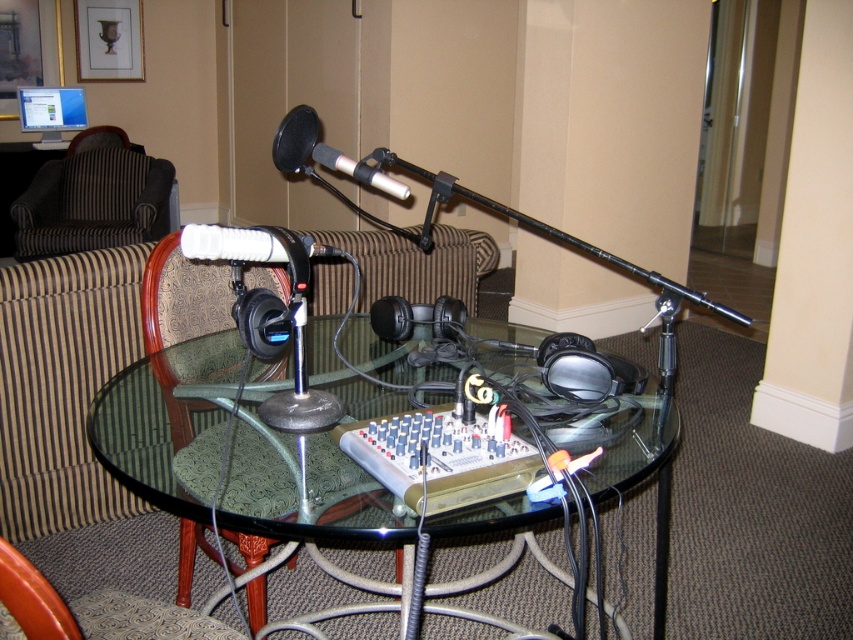
In the scene shown: You are setting up a recording session and need to place a new set of headphones on the transparent glass table at center. Given the size of the table and the headphones, will there be enough space for the new headphones without overlapping the existing black matte headphones at center?

The transparent glass table at center has a larger width than the black matte headphones at center, so there should be sufficient space to place the new headphones without overlapping the existing ones.

What object is located at the coordinates point (166, 424)?

The transparent glass table at center is located at point (166, 424).

You are a sound engineer setting up for a live recording session. You need to position yourself equidistant between the green fabric armchair at lower left and the brown striped armchair at upper left to ensure balanced audio pickup. What is the minimum distance you should stand from each chair to achieve this?

The distance between the green fabric armchair at lower left and the brown striped armchair at upper left is 3.70 meters. To stand equidistant from both, you should position yourself exactly halfway between them, which would be 1.85 meters away from each chair.